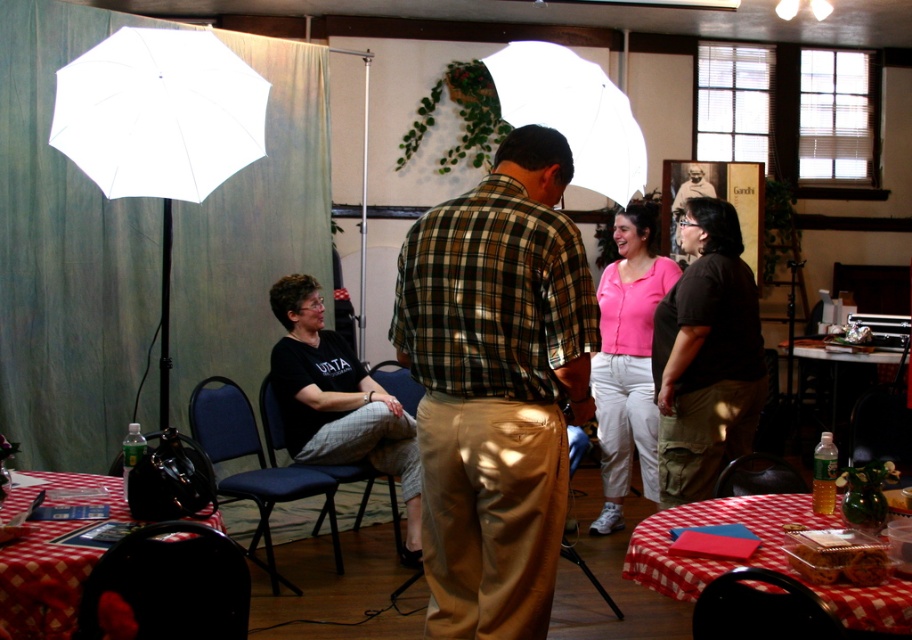
Question: Which point appears farthest from the camera in this image?

Choices:
 (A) (834, 592)
 (B) (592, 388)

Answer: (B)

Question: Is red checkered tablecloth at lower right wider than black plastic chair at lower center?

Choices:
 (A) no
 (B) yes

Answer: (B)

Question: Which point is closer to the camera taking this photo?

Choices:
 (A) (282, 433)
 (B) (768, 468)

Answer: (B)

Question: Which of the following is the farthest from the observer?

Choices:
 (A) (697, 164)
 (B) (44, 564)
 (C) (251, 486)

Answer: (A)

Question: Can you confirm if white fabric umbrella at center is thinner than blue fabric chair at center?

Choices:
 (A) yes
 (B) no

Answer: (B)

Question: Is the position of black cotton shirt at center more distant than that of checkered fabric table at lower left?

Choices:
 (A) yes
 (B) no

Answer: (A)